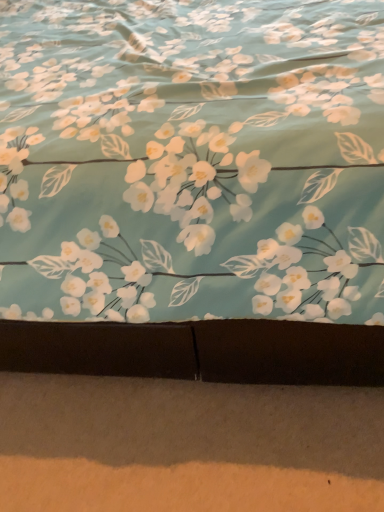
What is the approximate height of matte floral fabric at center?

30.59 inches.

What is the approximate width of matte floral fabric at center?

It is 1.74 meters.

The height and width of the screenshot is (512, 384). What do you see at coordinates (192, 161) in the screenshot? I see `matte floral fabric at center` at bounding box center [192, 161].

In order to click on matte floral fabric at center in this screenshot , I will do `click(192, 161)`.

Locate an element on the screen. This screenshot has width=384, height=512. matte floral fabric at center is located at coordinates (192, 161).